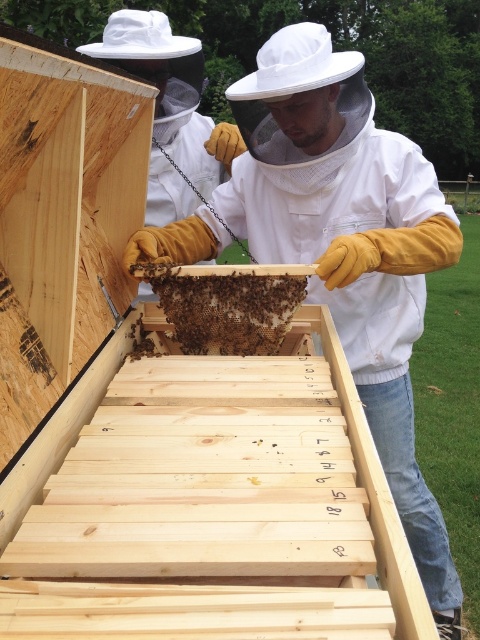
Between white mesh veil at center and brown honeycomb at center, which one appears on the left side from the viewer's perspective?

Positioned to the left is brown honeycomb at center.

Who is positioned more to the right, white mesh veil at center or brown honeycomb at center?

white mesh veil at center

Locate an element on the screen. The height and width of the screenshot is (640, 480). white mesh veil at center is located at coordinates (350, 248).